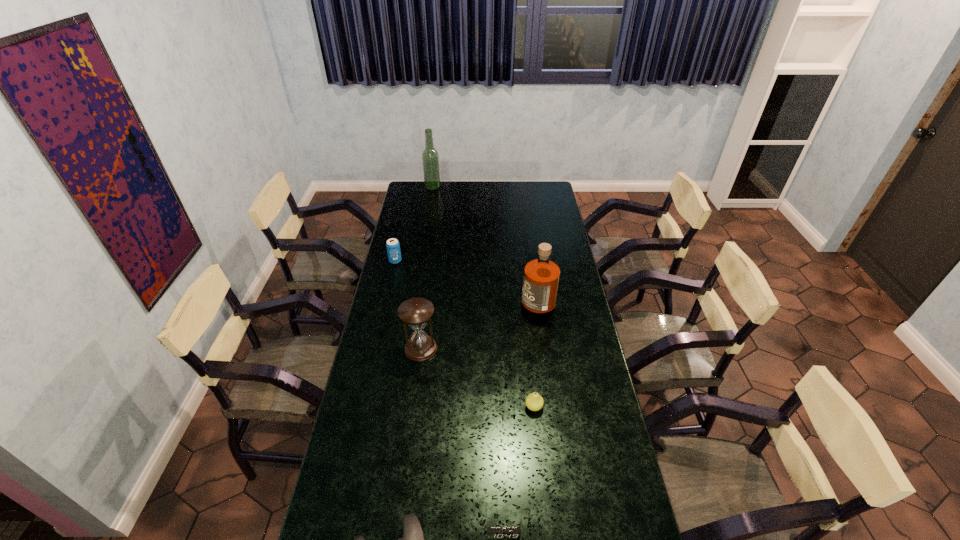
You are a GUI agent. You are given a task and a screenshot of the screen. Output one action in this format:
    pyautogui.click(x=<x>, y=<y>)
    Task: Click on the hourglass that is at the left edge
    The width and height of the screenshot is (960, 540).
    Given the screenshot: What is the action you would take?
    pyautogui.click(x=415, y=312)

Locate an element on the screen. The image size is (960, 540). soda can situated at the left edge is located at coordinates (393, 247).

Image resolution: width=960 pixels, height=540 pixels. What are the coordinates of `object that is at the right edge` in the screenshot? It's located at (541, 277).

At what (x,y) coordinates should I click in order to perform the action: click on object present at the far left corner. Please return your answer as a coordinate pair (x, y). The width and height of the screenshot is (960, 540). Looking at the image, I should click on (430, 158).

This screenshot has height=540, width=960. In the image, there is a desktop. In order to click on vacant space at the far edge in this screenshot , I will do `click(509, 202)`.

Find the location of a particular element. This screenshot has width=960, height=540. vacant space at the left edge of the desktop is located at coordinates (382, 346).

The image size is (960, 540). I want to click on blank area at the right edge, so click(x=576, y=418).

The image size is (960, 540). Identify the location of vacant space at the far left corner of the desktop. (417, 197).

You are a GUI agent. You are given a task and a screenshot of the screen. Output one action in this format:
    pyautogui.click(x=<x>, y=<y>)
    Task: Click on the vacant space at the far right corner of the desktop
    The height and width of the screenshot is (540, 960).
    Given the screenshot: What is the action you would take?
    pyautogui.click(x=552, y=191)

Where is `free space that is in between the second farthest object and the alarm clock`? This screenshot has width=960, height=540. free space that is in between the second farthest object and the alarm clock is located at coordinates (449, 397).